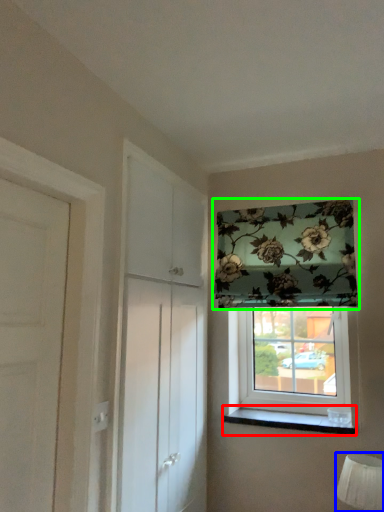
Question: Which is farther away from window sill (highlighted by a red box)? table lamp (highlighted by a blue box) or window (highlighted by a green box)?

Choices:
 (A) table lamp
 (B) window

Answer: (B)